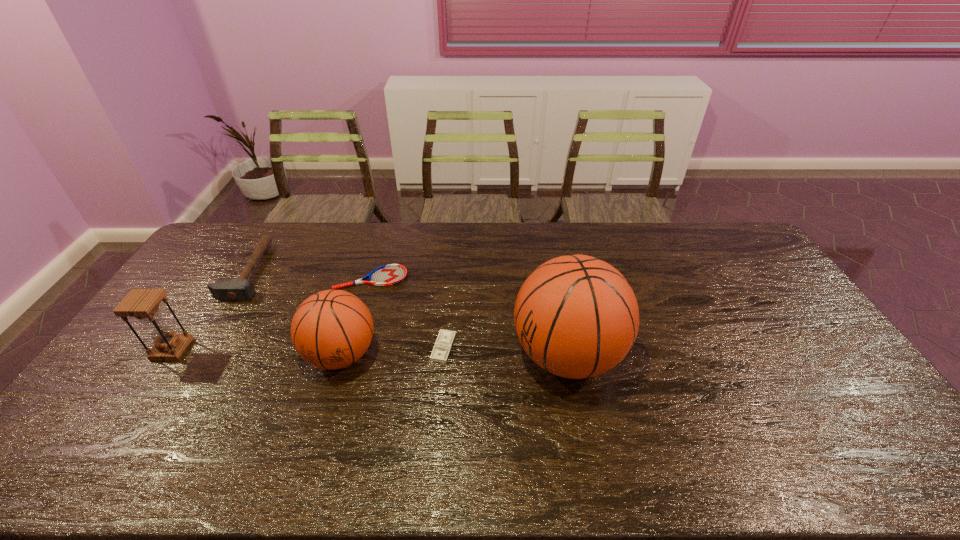
At what (x,y) coordinates should I click in order to perform the action: click on the left basketball. Please return your answer as a coordinate pair (x, y). Looking at the image, I should click on (332, 329).

The width and height of the screenshot is (960, 540). In order to click on the taller basketball in this screenshot , I will do `click(576, 316)`.

The image size is (960, 540). I want to click on the right basketball, so click(576, 316).

Where is `the third shortest object`? This screenshot has height=540, width=960. the third shortest object is located at coordinates (241, 289).

Locate an element on the screen. tennis racket is located at coordinates (390, 274).

Locate an element on the screen. the fifth object from left to right is located at coordinates (445, 339).

Find the location of a particular element. The image size is (960, 540). hourglass is located at coordinates (143, 304).

Identify the location of free space located 0.100m on the right of the left basketball. (413, 355).

Locate an element on the screen. The height and width of the screenshot is (540, 960). vacant space located 0.170m on the back of the rightmost object is located at coordinates (553, 280).

Find the location of `free spot located 0.130m on the striking surface of the fourth tallest object`. free spot located 0.130m on the striking surface of the fourth tallest object is located at coordinates (304, 272).